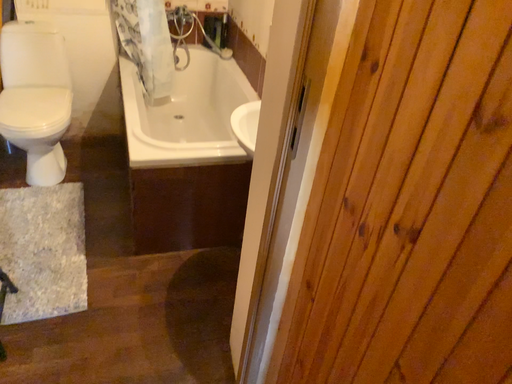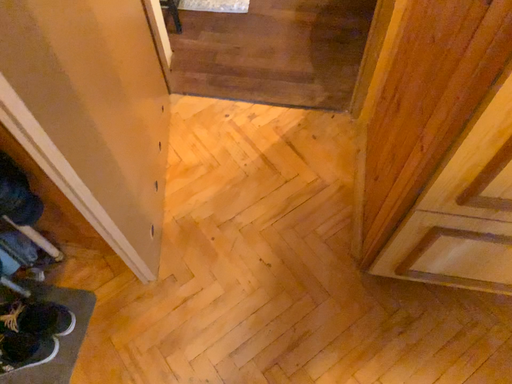
Question: Which way did the camera rotate in the video?

Choices:
 (A) rotated upward
 (B) rotated downward

Answer: (B)